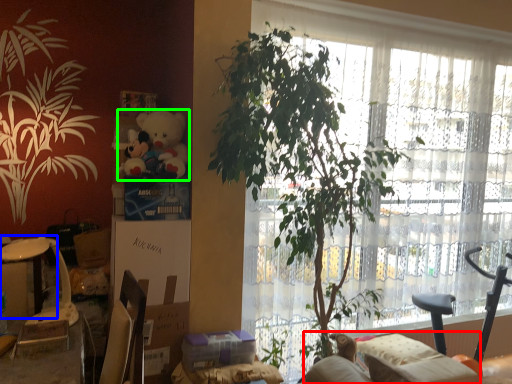
Question: Which object is positioned closest to couch (highlighted by a red box)? Select from table (highlighted by a blue box) and toy (highlighted by a green box).

Choices:
 (A) table
 (B) toy

Answer: (B)